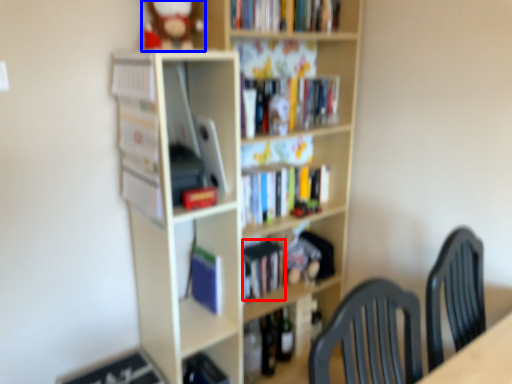
Question: Among these objects, which one is nearest to the camera, book (highlighted by a red box) or toy (highlighted by a blue box)?

Choices:
 (A) book
 (B) toy

Answer: (B)